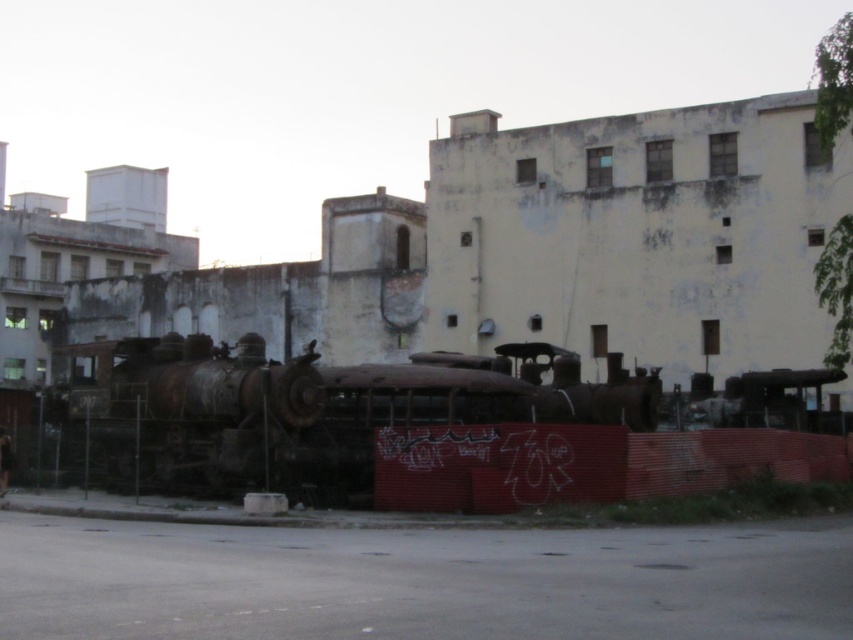
Is rusty metal train at center bigger than rusty metal steam locomotive at left?

Yes.

Measure the distance from rusty metal train at center to rusty metal steam locomotive at left.

rusty metal train at center is 3.46 meters away from rusty metal steam locomotive at left.

Between point (508, 401) and point (222, 412), which one is positioned in front?

Point (222, 412)

In order to click on rusty metal train at center in this screenshot , I will do `click(372, 422)`.